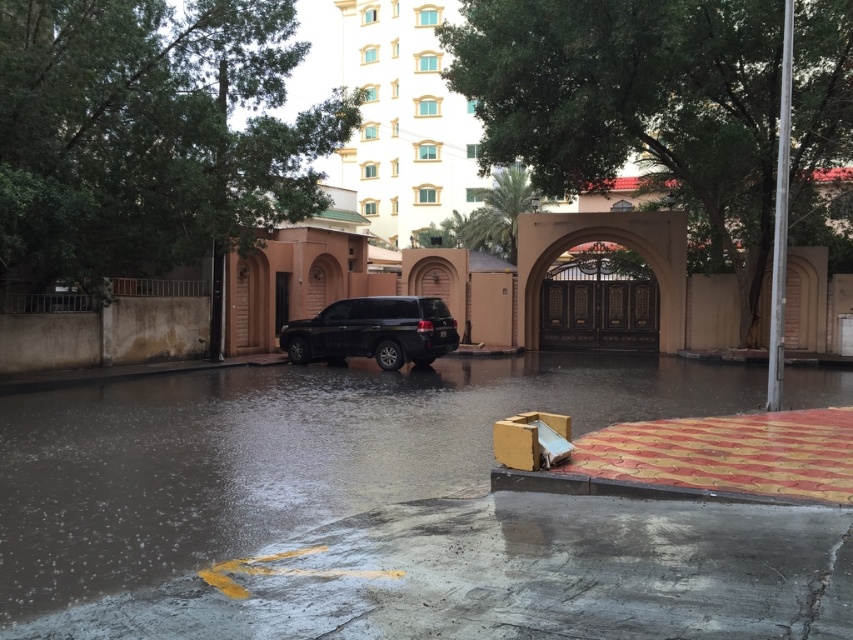
Question: Which object is farther from the camera taking this photo?

Choices:
 (A) white glossy building at upper center
 (B) glossy concrete flood at center

Answer: (A)

Question: Which point appears farthest from the camera in this image?

Choices:
 (A) (469, 131)
 (B) (647, 212)
 (C) (412, 316)
 (D) (177, 522)

Answer: (A)

Question: Observing the image, what is the correct spatial positioning of white glossy building at upper center in reference to brown polished wood archway at center?

Choices:
 (A) above
 (B) below

Answer: (A)

Question: Is glossy concrete flood at center further to the viewer compared to black matte suv at center?

Choices:
 (A) no
 (B) yes

Answer: (A)

Question: Does glossy concrete flood at center appear under brown polished wood archway at center?

Choices:
 (A) yes
 (B) no

Answer: (A)

Question: Which object appears farthest from the camera in this image?

Choices:
 (A) white glossy building at upper center
 (B) glossy concrete flood at center
 (C) brown polished wood archway at center

Answer: (A)